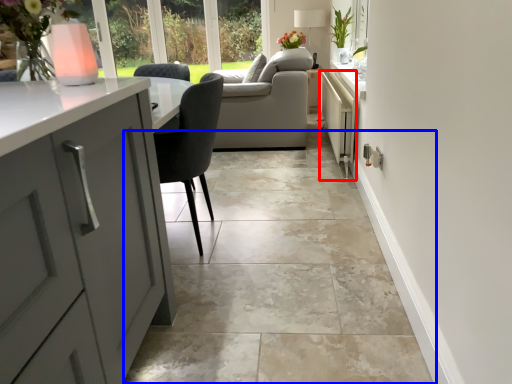
Question: Among these objects, which one is nearest to the camera, appliance (highlighted by a red box) or ceramic tile (highlighted by a blue box)?

Choices:
 (A) appliance
 (B) ceramic tile

Answer: (B)